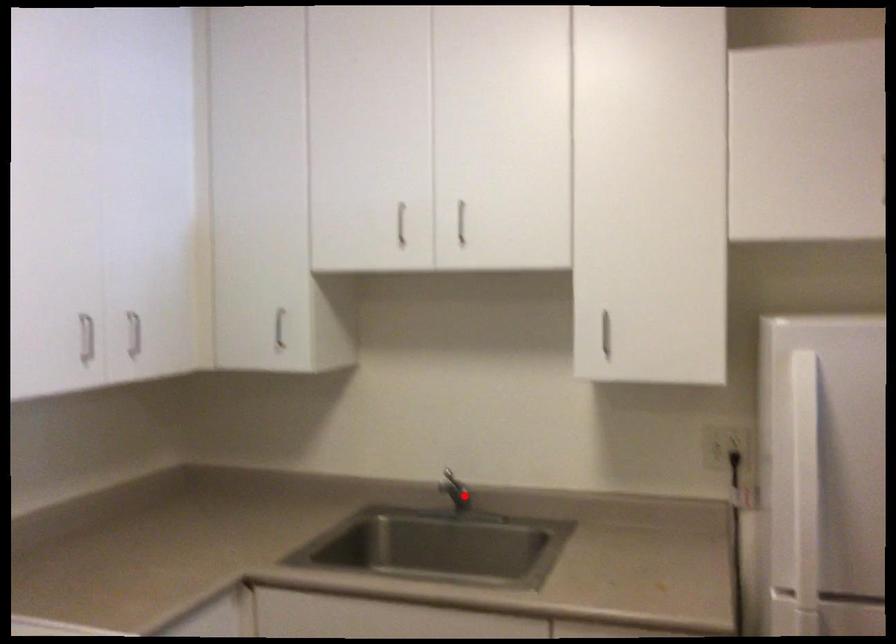
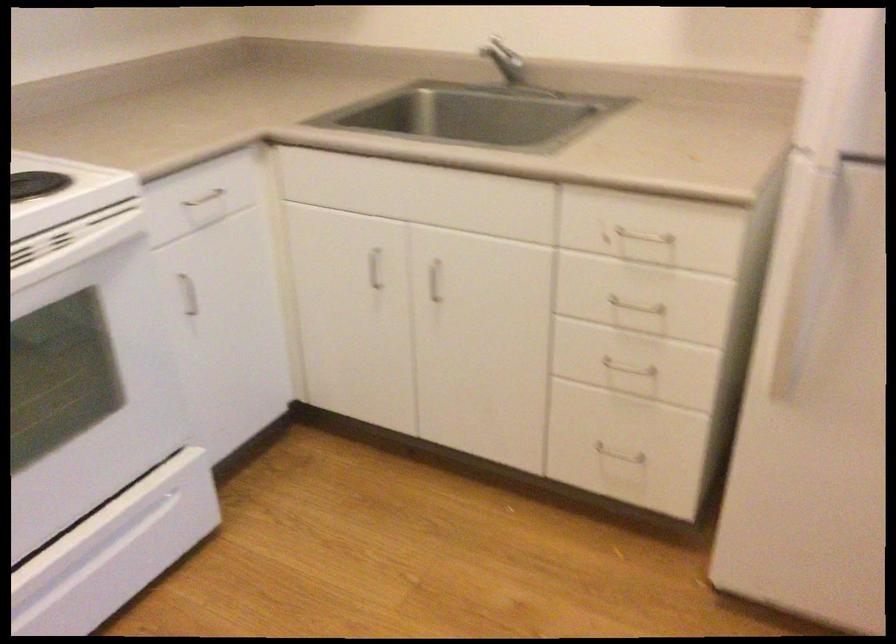
Where in the second image is the point corresponding to the highlighted location from the first image?

(510, 68)